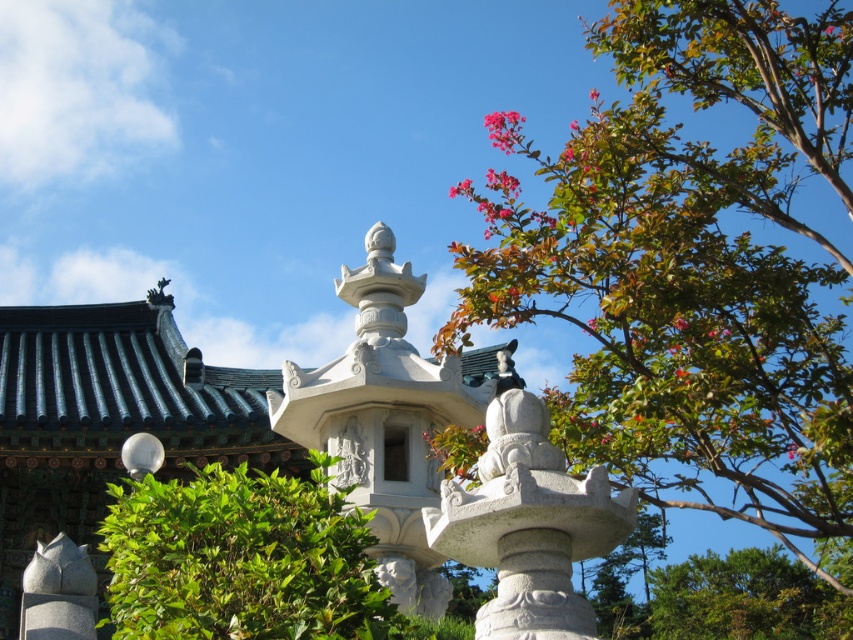
Question: Among these objects, which one is farthest from the camera?

Choices:
 (A) white stone statue at center
 (B) white stone lantern at center

Answer: (A)

Question: Is green leafy tree at upper right positioned behind white stone lantern at center?

Choices:
 (A) yes
 (B) no

Answer: (A)

Question: Which object is positioned farthest from the green leafy tree at upper right?

Choices:
 (A) green leafy bush at lower right
 (B) pink matte flower at upper right
 (C) white stone carving at center

Answer: (C)

Question: Which of these objects is positioned farthest from the green leafy bush at lower right?

Choices:
 (A) white stone statue at center
 (B) white stone lantern at center

Answer: (B)

Question: Does white stone lantern at center appear on the left side of white stone carving at center?

Choices:
 (A) yes
 (B) no

Answer: (B)

Question: Is green leafy hedge at center smaller than white stone statue at center?

Choices:
 (A) no
 (B) yes

Answer: (A)